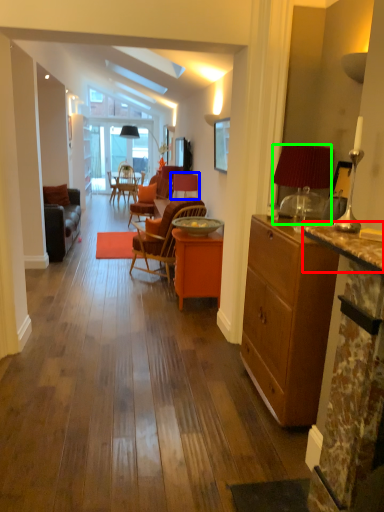
Question: Which object is the farthest from counter top (highlighted by a red box)? Choose among these: chair (highlighted by a blue box) or lamp (highlighted by a green box).

Choices:
 (A) chair
 (B) lamp

Answer: (A)